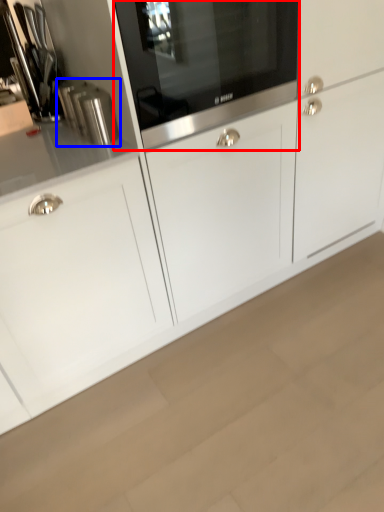
Question: Which of the following is the closest to the observer, home appliance (highlighted by a red box) or kitchen appliance (highlighted by a blue box)?

Choices:
 (A) home appliance
 (B) kitchen appliance

Answer: (A)